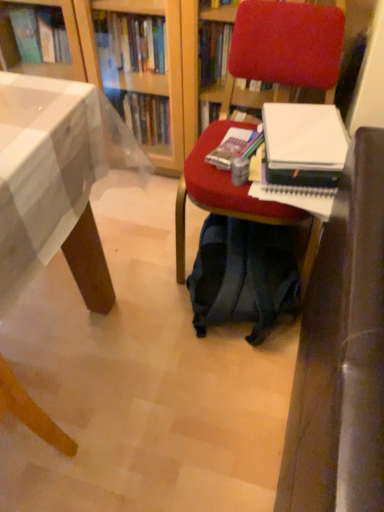
Question: Could dark blue fabric backpack at center be considered to be inside white paper at center right?

Choices:
 (A) yes
 (B) no

Answer: (B)

Question: Does white paper at center right appear on the left side of dark blue fabric backpack at center?

Choices:
 (A) no
 (B) yes

Answer: (A)

Question: From the image's perspective, is white paper at center right below dark blue fabric backpack at center?

Choices:
 (A) yes
 (B) no

Answer: (B)

Question: Does white paper at center right have a lesser height compared to dark blue fabric backpack at center?

Choices:
 (A) yes
 (B) no

Answer: (A)

Question: Can you confirm if white paper at center right is smaller than dark blue fabric backpack at center?

Choices:
 (A) yes
 (B) no

Answer: (A)

Question: Is white paper at center right bigger than dark blue fabric backpack at center?

Choices:
 (A) yes
 (B) no

Answer: (B)

Question: Is the position of wooden desk at lower left less distant than that of white paper at center right?

Choices:
 (A) no
 (B) yes

Answer: (B)

Question: From a real-world perspective, is wooden desk at lower left positioned under white paper at center right based on gravity?

Choices:
 (A) no
 (B) yes

Answer: (B)

Question: Is wooden desk at lower left further to camera compared to white paper at center right?

Choices:
 (A) yes
 (B) no

Answer: (B)

Question: Does wooden desk at lower left turn towards white paper at center right?

Choices:
 (A) yes
 (B) no

Answer: (B)

Question: Is wooden desk at lower left taller than white paper at center right?

Choices:
 (A) yes
 (B) no

Answer: (A)

Question: Does wooden desk at lower left have a smaller size compared to white paper at center right?

Choices:
 (A) yes
 (B) no

Answer: (B)

Question: Is white paper at center right to the right of velvet red chair at center from the viewer's perspective?

Choices:
 (A) yes
 (B) no

Answer: (A)